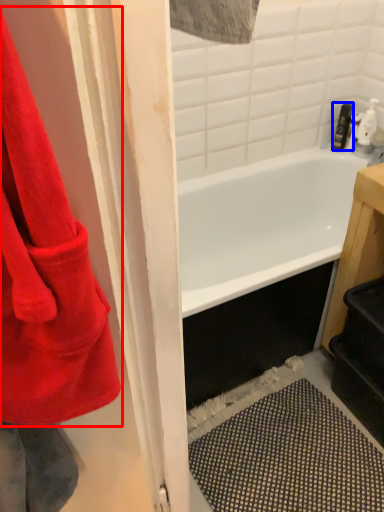
Question: Which object is further to the camera taking this photo, towel (highlighted by a red box) or toiletry (highlighted by a blue box)?

Choices:
 (A) towel
 (B) toiletry

Answer: (B)